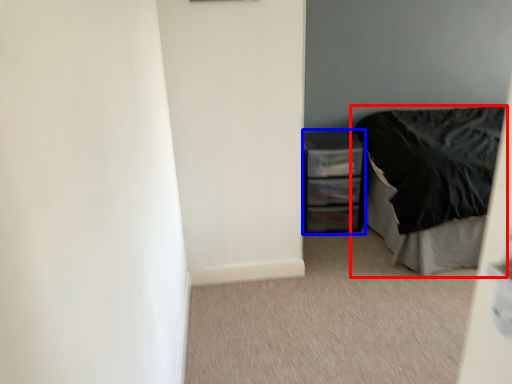
Question: Which object is further to the camera taking this photo, bed (highlighted by a red box) or chest of drawers (highlighted by a blue box)?

Choices:
 (A) bed
 (B) chest of drawers

Answer: (B)